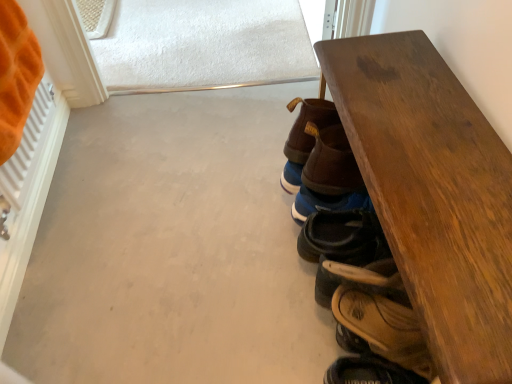
Question: Is wooden table at right positioned before brown leather sandal at lower right, which ranks as the 4th footwear in top-to-bottom order?

Choices:
 (A) yes
 (B) no

Answer: (A)

Question: Considering the relative sizes of wooden table at right and brown leather sandal at lower right, which ranks as the 4th footwear in top-to-bottom order, in the image provided, is wooden table at right taller than brown leather sandal at lower right, which ranks as the 4th footwear in top-to-bottom order,?

Choices:
 (A) yes
 (B) no

Answer: (A)

Question: Is wooden table at right not within brown leather sandal at lower right, acting as the 1th footwear starting from the bottom?

Choices:
 (A) no
 (B) yes

Answer: (B)

Question: Is wooden table at right oriented away from brown leather sandal at lower right, acting as the 1th footwear starting from the bottom?

Choices:
 (A) no
 (B) yes

Answer: (B)

Question: Is wooden table at right positioned behind brown leather sandal at lower right, which ranks as the 4th footwear in top-to-bottom order?

Choices:
 (A) yes
 (B) no

Answer: (B)

Question: In the image, is brown leather sandal at lower right, which ranks as the 4th footwear in top-to-bottom order, on the left side or the right side of wooden table at right?

Choices:
 (A) right
 (B) left

Answer: (B)

Question: From a real-world perspective, is brown leather sandal at lower right, which ranks as the 4th footwear in top-to-bottom order, physically located above or below wooden table at right?

Choices:
 (A) below
 (B) above

Answer: (A)

Question: Is point (431, 362) closer or farther from the camera than point (444, 299)?

Choices:
 (A) farther
 (B) closer

Answer: (A)

Question: Considering the positions of brown leather sandal at lower right, acting as the 1th footwear starting from the bottom, and wooden table at right in the image, is brown leather sandal at lower right, acting as the 1th footwear starting from the bottom, wider or thinner than wooden table at right?

Choices:
 (A) thin
 (B) wide

Answer: (A)

Question: Would you say wooden table at right is inside or outside leather sandal at lower right, the third footwear positioned from the top?

Choices:
 (A) inside
 (B) outside

Answer: (B)

Question: From their relative heights in the image, would you say wooden table at right is taller or shorter than leather sandal at lower right, which is the second footwear from bottom to top?

Choices:
 (A) tall
 (B) short

Answer: (A)

Question: Is wooden table at right in front of or behind leather sandal at lower right, which is the second footwear from bottom to top, in the image?

Choices:
 (A) behind
 (B) front

Answer: (B)

Question: From a real-world perspective, is wooden table at right physically located above or below leather sandal at lower right, the third footwear positioned from the top?

Choices:
 (A) above
 (B) below

Answer: (B)

Question: In the image, is brown leather sandal at lower right, which ranks as the 4th footwear in top-to-bottom order, on the left side or the right side of brown leather shoe at center, marked as the first footwear in a top-to-bottom arrangement?

Choices:
 (A) left
 (B) right

Answer: (B)

Question: From the image's perspective, is brown leather sandal at lower right, which ranks as the 4th footwear in top-to-bottom order, positioned above or below brown leather shoe at center, marked as the first footwear in a top-to-bottom arrangement?

Choices:
 (A) above
 (B) below

Answer: (B)